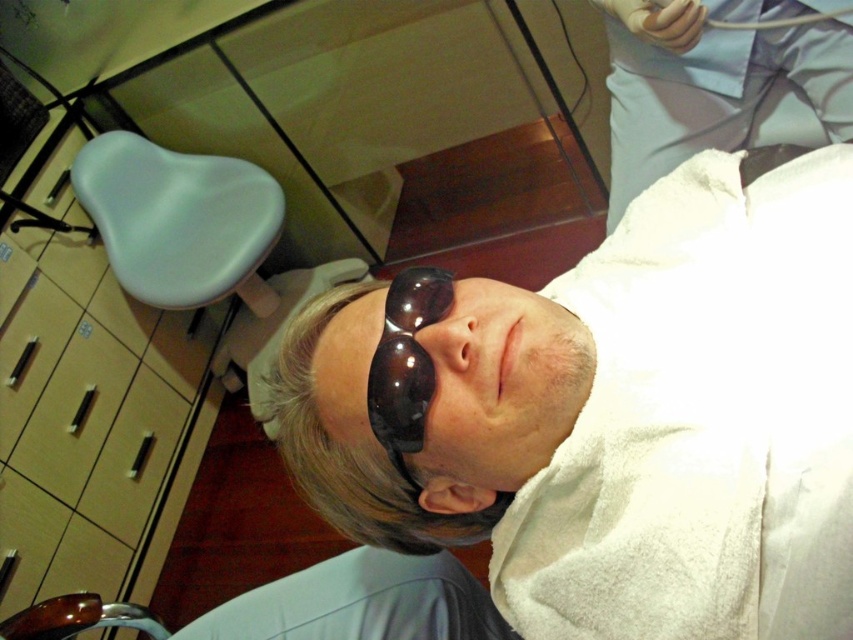
Question: Is white cloth at upper right to the right of light blue plastic chair at left from the viewer's perspective?

Choices:
 (A) no
 (B) yes

Answer: (B)

Question: Which object is positioned farthest from the light blue plastic chair at left?

Choices:
 (A) dark matte glasses at center
 (B) white cloth at upper right

Answer: (A)

Question: In this image, where is light blue plastic chair at left located relative to dark matte glasses at center?

Choices:
 (A) right
 (B) left

Answer: (B)

Question: Which point is farther to the camera?

Choices:
 (A) dark matte glasses at center
 (B) light blue plastic chair at left

Answer: (B)

Question: Which point is closer to the camera?

Choices:
 (A) (399, 388)
 (B) (689, 132)

Answer: (A)

Question: Does white cloth at upper right lie behind dark matte glasses at center?

Choices:
 (A) yes
 (B) no

Answer: (A)